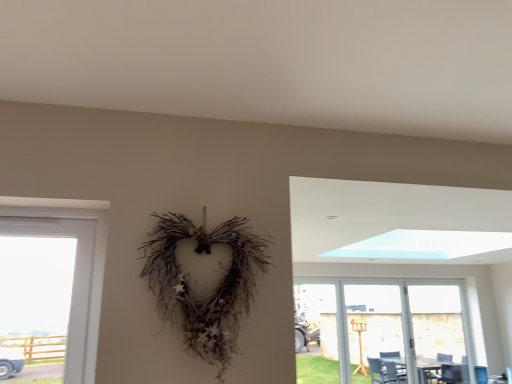
Question: Is the position of transparent plastic screen door at right, marked as the second screen door in a right-to-left arrangement, less distant than that of transparent glass door at lower right?

Choices:
 (A) yes
 (B) no

Answer: (B)

Question: Is transparent glass door at lower right located within transparent plastic screen door at right, the first screen door in the left-to-right sequence?

Choices:
 (A) yes
 (B) no

Answer: (B)

Question: Can you confirm if transparent plastic screen door at right, the first screen door in the left-to-right sequence, is shorter than transparent glass door at lower right?

Choices:
 (A) yes
 (B) no

Answer: (B)

Question: Considering the relative sizes of transparent plastic screen door at right, the first screen door in the left-to-right sequence, and transparent glass door at lower right in the image provided, is transparent plastic screen door at right, the first screen door in the left-to-right sequence, smaller than transparent glass door at lower right?

Choices:
 (A) no
 (B) yes

Answer: (B)

Question: Would you consider transparent plastic screen door at right, marked as the second screen door in a right-to-left arrangement, to be distant from transparent glass door at lower right?

Choices:
 (A) yes
 (B) no

Answer: (B)

Question: Is point (365, 344) closer or farther from the camera than point (380, 289)?

Choices:
 (A) closer
 (B) farther

Answer: (A)

Question: Would you say transparent plastic screen door at right, marked as the second screen door in a right-to-left arrangement, is inside or outside transparent glass door at lower right?

Choices:
 (A) outside
 (B) inside

Answer: (B)

Question: Visually, is transparent plastic screen door at right, marked as the second screen door in a right-to-left arrangement, positioned to the left or to the right of transparent glass door at lower right?

Choices:
 (A) right
 (B) left

Answer: (B)

Question: From the image's perspective, is transparent plastic screen door at right, marked as the second screen door in a right-to-left arrangement, above or below transparent glass door at lower right?

Choices:
 (A) above
 (B) below

Answer: (A)

Question: From their relative heights in the image, would you say transparent glass door at lower right is taller or shorter than transparent plastic screen door at right, the first screen door in the left-to-right sequence?

Choices:
 (A) tall
 (B) short

Answer: (B)

Question: Is transparent glass door at lower right to the left or to the right of transparent plastic screen door at right, the first screen door in the left-to-right sequence, in the image?

Choices:
 (A) left
 (B) right

Answer: (B)

Question: In terms of width, does transparent glass door at lower right look wider or thinner when compared to transparent plastic screen door at right, marked as the second screen door in a right-to-left arrangement?

Choices:
 (A) wide
 (B) thin

Answer: (A)

Question: Which is correct: transparent glass door at lower right is inside transparent plastic screen door at right, marked as the second screen door in a right-to-left arrangement, or outside of it?

Choices:
 (A) inside
 (B) outside

Answer: (B)

Question: In the image, is transparent plastic screen door at right, the first screen door in the left-to-right sequence, on the left side or the right side of transparent glass screen door at right, which is the 1th screen door from right to left?

Choices:
 (A) left
 (B) right

Answer: (A)

Question: In the image, is transparent plastic screen door at right, the first screen door in the left-to-right sequence, positioned in front of or behind transparent glass screen door at right, which is the 1th screen door from right to left?

Choices:
 (A) behind
 (B) front

Answer: (B)